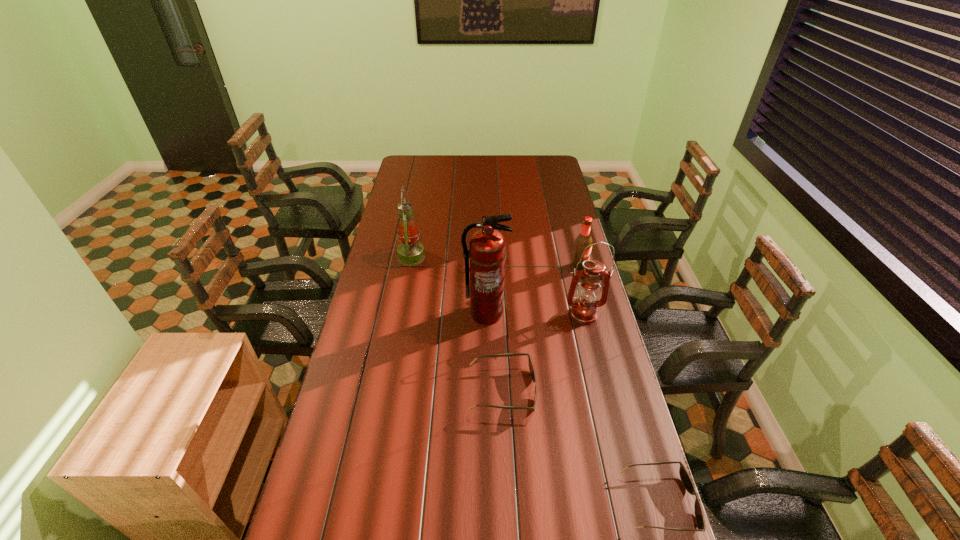
You are a GUI agent. You are given a task and a screenshot of the screen. Output one action in this format:
    pyautogui.click(x=<x>, y=<y>)
    Task: Click on the vacant space located on the right of the farther oil lamp
    The image size is (960, 540).
    Given the screenshot: What is the action you would take?
    pyautogui.click(x=448, y=257)

At what (x,y) coordinates should I click in order to perform the action: click on vacant space situated 0.350m on the left of the fourth tallest object. Please return your answer as a coordinate pair (x, y). This screenshot has width=960, height=540. Looking at the image, I should click on [x=488, y=267].

What are the coordinates of `free spot located on the side of the tallest object with the handle and hose` in the screenshot? It's located at (487, 340).

Identify the location of vacant region located 0.090m on the left of the right oil lamp. (539, 315).

Locate an element on the screen. object positioned at the near edge is located at coordinates (684, 475).

Image resolution: width=960 pixels, height=540 pixels. In order to click on object positioned at the left edge in this screenshot , I will do `click(410, 252)`.

The width and height of the screenshot is (960, 540). I want to click on sunglasses present at the right edge, so click(x=684, y=475).

The image size is (960, 540). What are the coordinates of `beer bottle that is at the right edge` in the screenshot? It's located at point(584,239).

Find the location of a particular element. Image resolution: width=960 pixels, height=540 pixels. oil lamp located in the right edge section of the desktop is located at coordinates coord(584,309).

This screenshot has height=540, width=960. In order to click on object that is at the near right corner in this screenshot , I will do `click(684, 475)`.